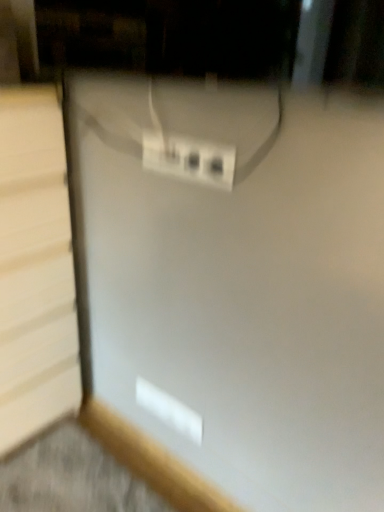
Image resolution: width=384 pixels, height=512 pixels. Describe the element at coordinates (189, 159) in the screenshot. I see `white plastic power plugs and sockets at center` at that location.

Where is `white plastic power plugs and sockets at center`? Image resolution: width=384 pixels, height=512 pixels. white plastic power plugs and sockets at center is located at coordinates (189, 159).

Locate an element on the screen. white plastic power plugs and sockets at center is located at coordinates (189, 159).